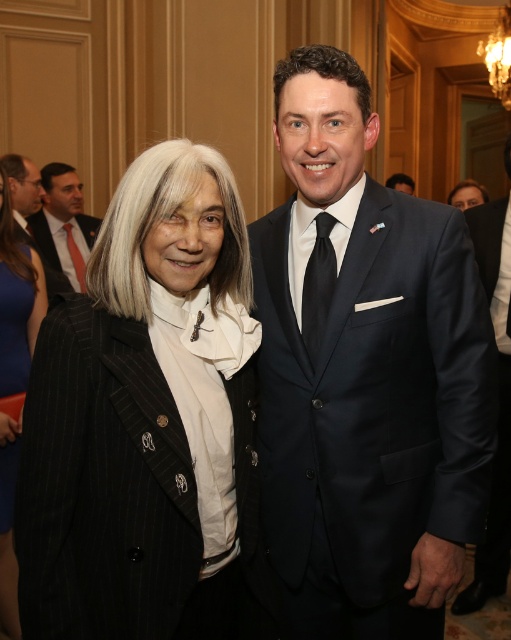
Which of these two, shiny dark suit at center or black pinstripe suit at left, stands shorter?

black pinstripe suit at left is shorter.

Can you confirm if shiny dark suit at center is wider than black pinstripe suit at left?

Yes, shiny dark suit at center is wider than black pinstripe suit at left.

Looking at this image, who is more forward, (271, 298) or (47, 529)?

Positioned in front is point (47, 529).

What are the coordinates of `shiny dark suit at center` in the screenshot? It's located at (366, 378).

Does point (53, 216) lie behind point (318, 353)?

That is True.

Which is more to the right, matte black suit at upper left or black satin tie at center?

From the viewer's perspective, black satin tie at center appears more on the right side.

Who is more distant from viewer, [74,259] or [332,269]?

Point [74,259]

Find the location of `matte black suit at upper left`. matte black suit at upper left is located at coordinates (63, 224).

Which is above, black satin tie at center or matte black jacket at center?

matte black jacket at center

Between black satin tie at center and matte black jacket at center, which one has more height?

Standing taller between the two is black satin tie at center.

The image size is (511, 640). What do you see at coordinates (317, 288) in the screenshot?
I see `black satin tie at center` at bounding box center [317, 288].

Locate an element on the screen. black satin tie at center is located at coordinates (317, 288).